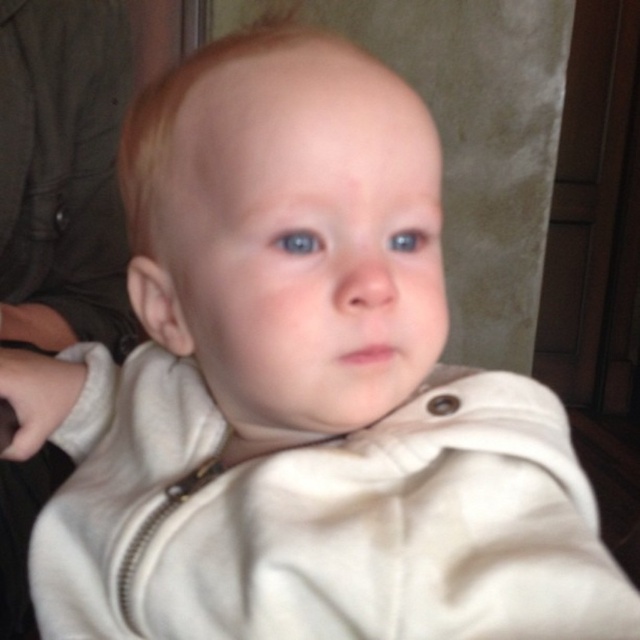
Can you confirm if white soft jacket at center is wider than blue glossy eye at upper center?

Correct, the width of white soft jacket at center exceeds that of blue glossy eye at upper center.

Which is behind, point (100, 12) or point (422, 237)?

Point (100, 12)

Where is `white soft jacket at center`? This screenshot has width=640, height=640. white soft jacket at center is located at coordinates (61, 172).

Which is in front, point (58, 81) or point (285, 248)?

Point (285, 248) is more forward.

Can you confirm if white soft jacket at center is positioned to the left of blue glossy eye at center?

Yes, white soft jacket at center is to the left of blue glossy eye at center.

Does point (74, 282) come in front of point (282, 244)?

No, it is not.

Identify the location of white soft jacket at center. pos(61,172).

Where is `blue glossy eye at center`? This screenshot has height=640, width=640. blue glossy eye at center is located at coordinates (298, 241).

Is blue glossy eye at center to the right of blue glossy eye at upper center from the viewer's perspective?

In fact, blue glossy eye at center is to the left of blue glossy eye at upper center.

Describe the element at coordinates (298, 241) in the screenshot. I see `blue glossy eye at center` at that location.

I want to click on blue glossy eye at center, so click(298, 241).